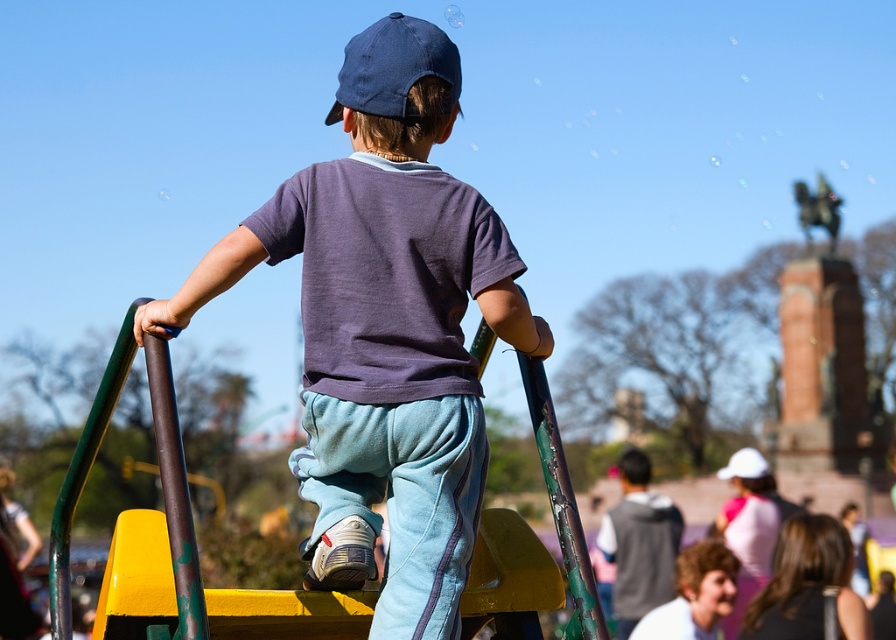
You are a photographer setting up a shot of the playground scene. You notice two hats in the frame. The first is a matte blue cap at center, and the second is a blue denim baseball cap at upper center. Which hat is positioned further to the left in the image?

The matte blue cap at center is positioned further to the left compared to the blue denim baseball cap at upper center.

You are a photographer trying to capture both the matte blue cap at center and the blue denim baseball cap at upper center in a single shot. Which cap would appear wider in the photo?

The matte blue cap at center would appear wider in the photo because its width surpasses that of the blue denim baseball cap at upper center.